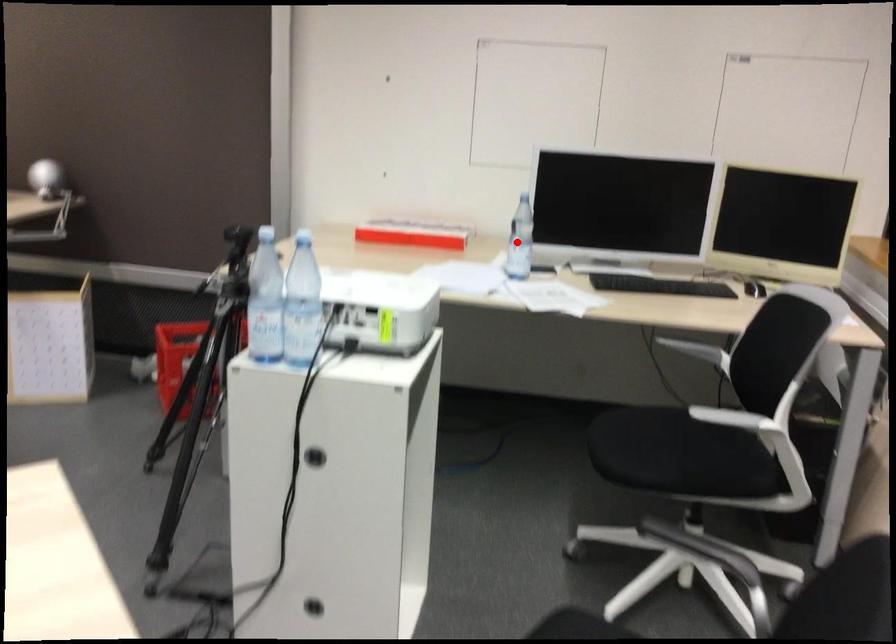
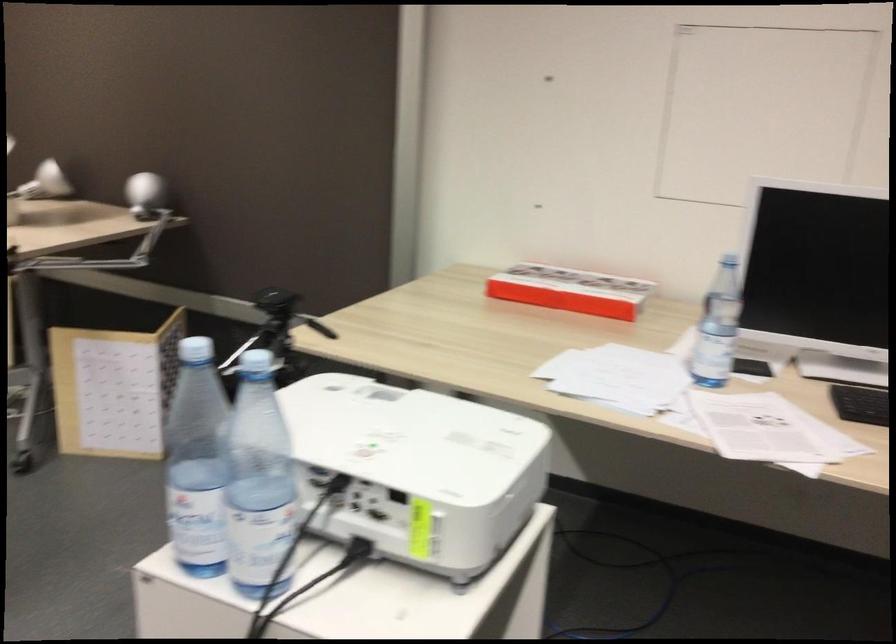
Question: I am providing you with two images of the same scene from different viewpoints. In image1, a red point is highlighted. Considering the same 3D point in image2, which of the following is correct?

Choices:
 (A) It is closer
 (B) It is farther

Answer: (A)